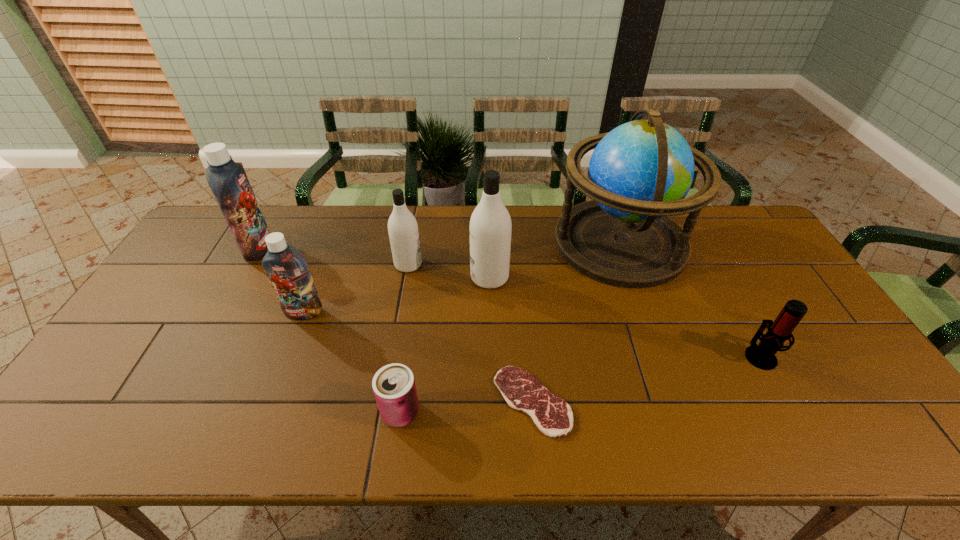
In the image, there is a desktop. Where is `vacant space at the near edge`? The width and height of the screenshot is (960, 540). vacant space at the near edge is located at coordinates pos(621,413).

At what (x,y) coordinates should I click in order to perform the action: click on vacant area at the left edge of the desktop. Please return your answer as a coordinate pair (x, y). The height and width of the screenshot is (540, 960). Looking at the image, I should click on (130, 368).

In the image, there is a desktop. At what (x,y) coordinates should I click in order to perform the action: click on blank space at the right edge. Please return your answer as a coordinate pair (x, y). Looking at the image, I should click on (761, 251).

Identify the location of empty location between the globe and the second shampoo from right to left. (515, 253).

Find the location of `free space between the tallest object and the steak`. free space between the tallest object and the steak is located at coordinates (576, 322).

What are the coordinates of `empty space between the globe and the fourth nearest object` in the screenshot? It's located at (462, 278).

Locate an element on the screen. unoccupied position between the fourth nearest object and the microphone is located at coordinates (532, 334).

Identify the location of free space between the tallest object and the right white shampoo. This screenshot has height=540, width=960. (555, 260).

This screenshot has width=960, height=540. Identify the location of vacant area that lies between the left white shampoo and the can. (404, 339).

Where is `free space between the seventh tallest object and the globe`? The width and height of the screenshot is (960, 540). free space between the seventh tallest object and the globe is located at coordinates (511, 327).